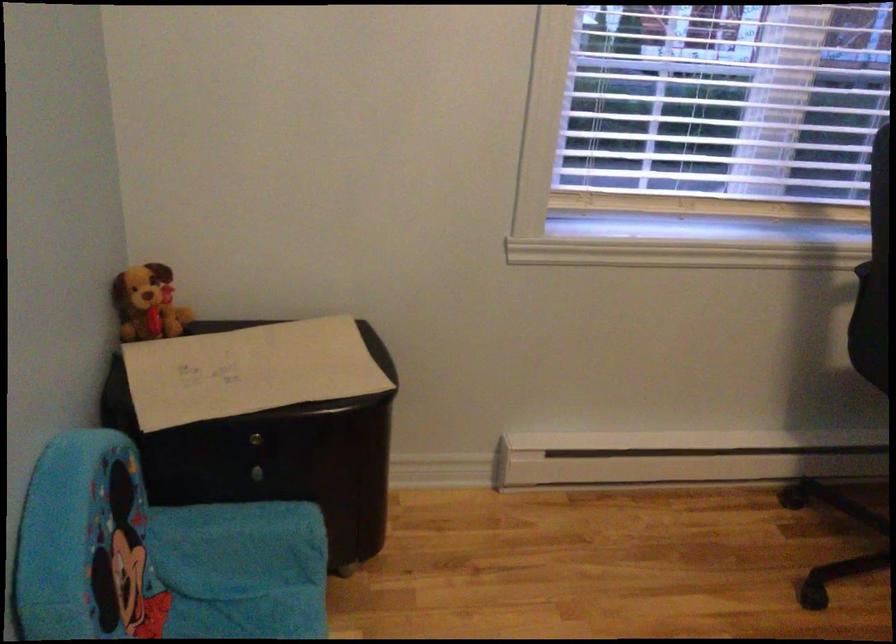
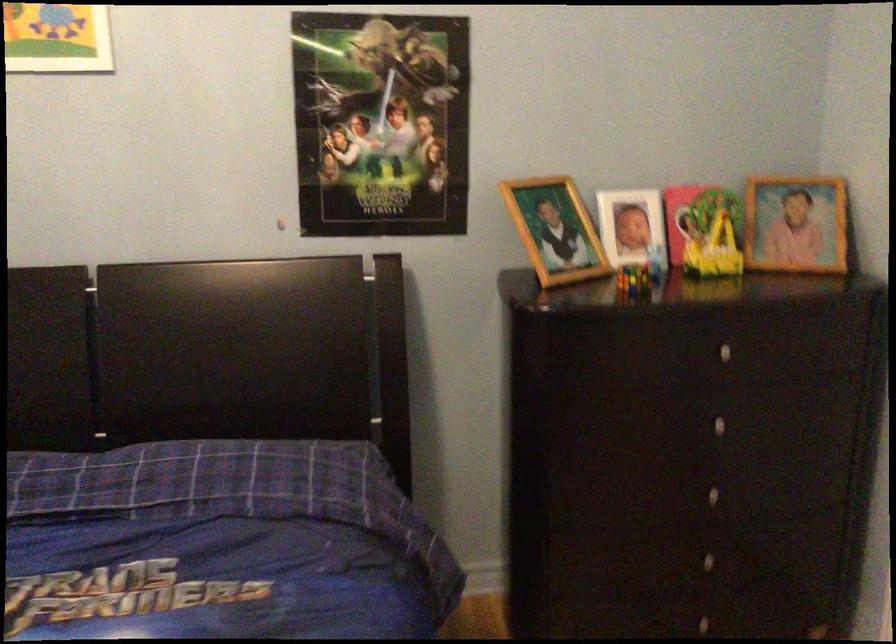
Based on the continuous images, in which direction is the camera rotating?

The camera rotated toward right-down.